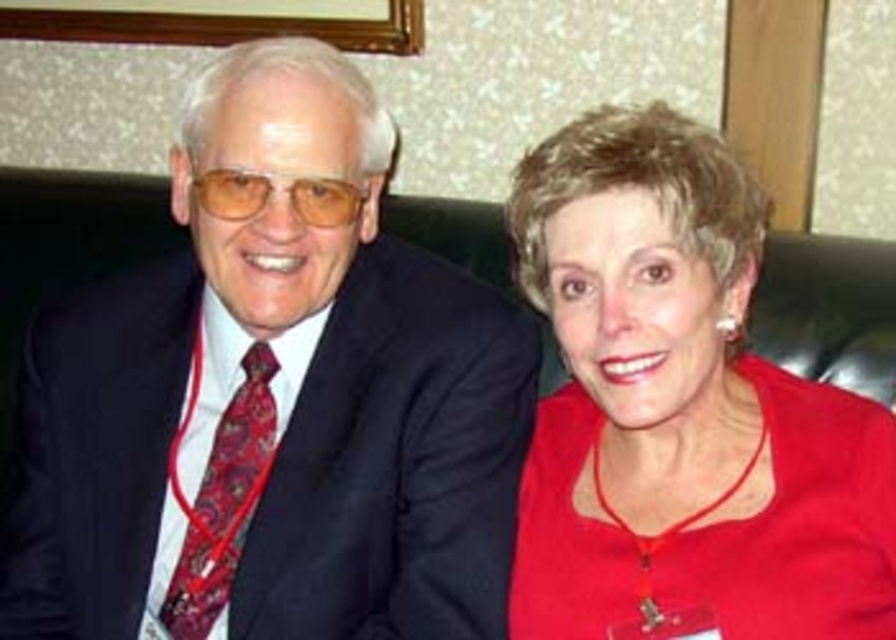
Question: Which of the following is the farthest from the observer?

Choices:
 (A) (227, 449)
 (B) (685, 289)

Answer: (A)

Question: Based on their relative distances, which object is nearer to the matte black suit at left?

Choices:
 (A) red matte shirt at right
 (B) paisley silk tie at left

Answer: (B)

Question: Does matte black suit at left come in front of paisley silk tie at left?

Choices:
 (A) yes
 (B) no

Answer: (A)

Question: Which object is the farthest from the matte black suit at left?

Choices:
 (A) red matte shirt at right
 (B) paisley silk tie at left

Answer: (A)

Question: Where is matte black suit at left located in relation to paisley silk tie at left in the image?

Choices:
 (A) above
 (B) below

Answer: (A)

Question: Is matte black suit at left positioned in front of paisley silk tie at left?

Choices:
 (A) no
 (B) yes

Answer: (B)